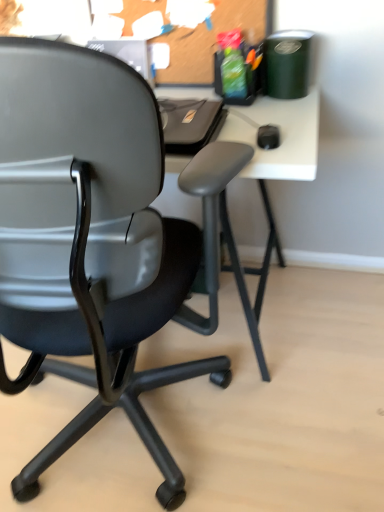
I want to click on vacant area that is in front of matte black chair at left, so click(193, 438).